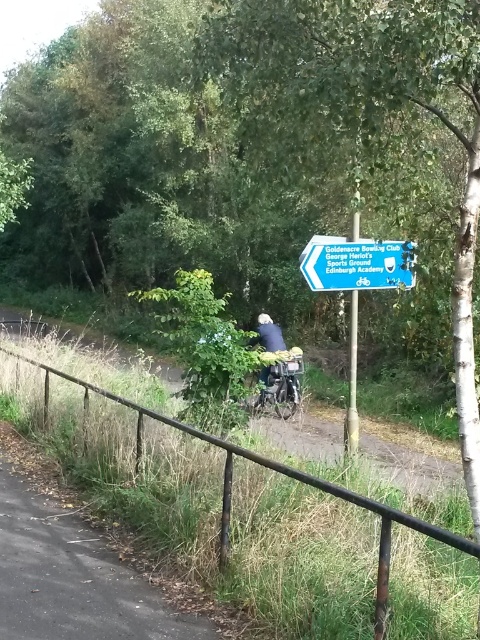
Question: Among these objects, which one is nearest to the camera?

Choices:
 (A) black metal fence at lower left
 (B) green plastic signpost at upper center
 (C) gravel path at lower left

Answer: (A)

Question: Which point is farther from the camera taking this photo?

Choices:
 (A) (387, 272)
 (B) (298, 353)
 (C) (354, 374)

Answer: (B)

Question: Is gravel path at lower left below shiny metallic bicycle at center?

Choices:
 (A) yes
 (B) no

Answer: (A)

Question: Can you confirm if black metal fence at lower left is positioned above gravel path at lower left?

Choices:
 (A) no
 (B) yes

Answer: (B)

Question: Which point is closer to the camera taking this photo?

Choices:
 (A) (288, 417)
 (B) (64, 637)

Answer: (B)

Question: Does gravel path at lower left have a greater width compared to metallic pole at center?

Choices:
 (A) yes
 (B) no

Answer: (A)